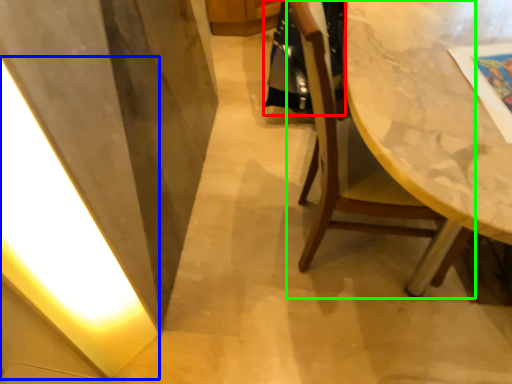
Question: Based on their relative distances, which object is nearer to robe (highlighted by a red box)? Choose from light (highlighted by a blue box) and chair (highlighted by a green box).

Choices:
 (A) light
 (B) chair

Answer: (B)